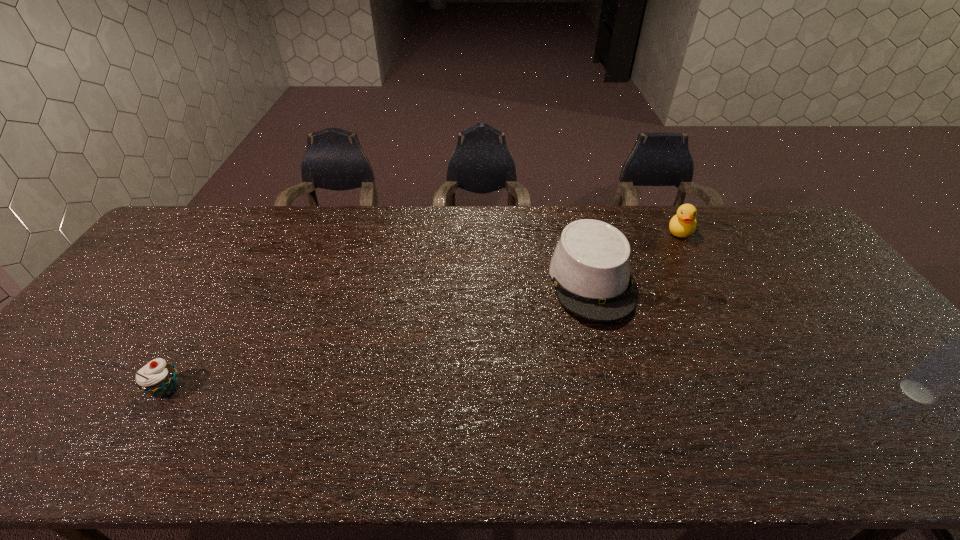
Find the location of `free space between the tallest object and the leftmost object`. free space between the tallest object and the leftmost object is located at coordinates (542, 390).

Where is `free space between the cupcake and the hat`? This screenshot has width=960, height=540. free space between the cupcake and the hat is located at coordinates (379, 335).

You are a GUI agent. You are given a task and a screenshot of the screen. Output one action in this format:
    pyautogui.click(x=<x>, y=<y>)
    Task: Click on the free spot between the duckling and the water bottle
    The image size is (960, 540).
    Given the screenshot: What is the action you would take?
    pyautogui.click(x=799, y=312)

Find the location of a particular element. free space between the second object from right to left and the hat is located at coordinates (636, 256).

Find the location of a particular element. Image resolution: width=960 pixels, height=540 pixels. empty location between the third nearest object and the leftmost object is located at coordinates (379, 335).

This screenshot has width=960, height=540. In order to click on object that is the second nearest to the cupcake in this screenshot , I will do `click(683, 224)`.

Find the location of a particular element. The height and width of the screenshot is (540, 960). object that stands as the third closest to the rightmost object is located at coordinates (157, 378).

This screenshot has height=540, width=960. What are the coordinates of `vacant area that satisfies the following two spatial constraints: 1. on the front side of the rightmost object; 2. on the right side of the second object from right to left` in the screenshot? It's located at (769, 392).

The height and width of the screenshot is (540, 960). Identify the location of free space that satisfies the following two spatial constraints: 1. on the front side of the third object from left to right; 2. on the right side of the water bottle. (769, 392).